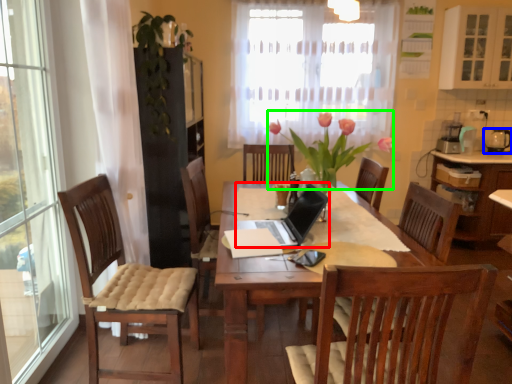
Question: Based on their relative distances, which object is farther from laptop (highlighted by a red box)? Choose from tableware (highlighted by a blue box) and floral arrangement (highlighted by a green box).

Choices:
 (A) tableware
 (B) floral arrangement

Answer: (A)